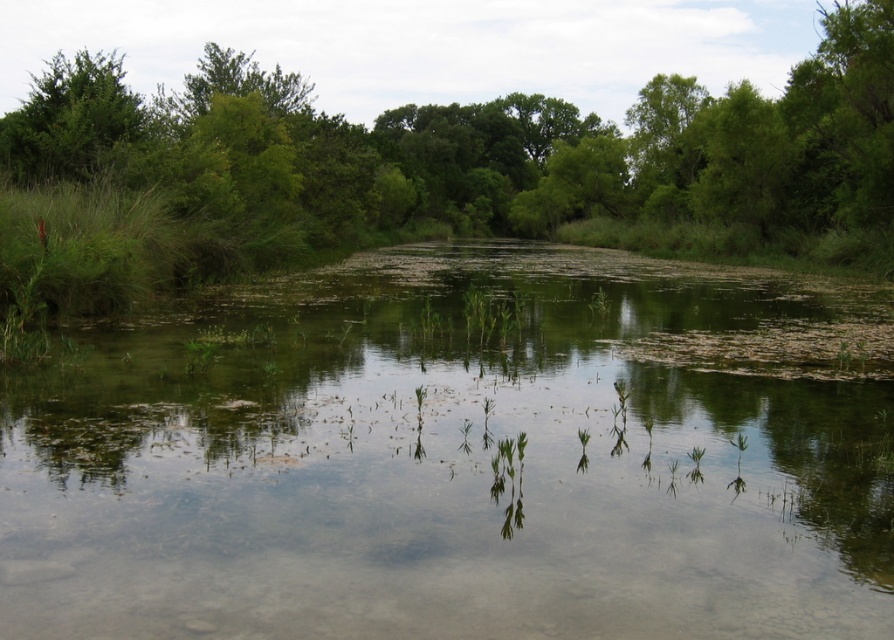
Question: Is clear water at center to the right of green leafy tree at upper left from the viewer's perspective?

Choices:
 (A) no
 (B) yes

Answer: (B)

Question: Which object is closer to the camera taking this photo?

Choices:
 (A) green leafy tree at upper left
 (B) clear water at center

Answer: (B)

Question: Which object is closer to the camera taking this photo?

Choices:
 (A) green leafy tree at upper left
 (B) clear water at center

Answer: (B)

Question: From the image, what is the correct spatial relationship of clear water at center in relation to green leafy tree at upper left?

Choices:
 (A) above
 (B) below

Answer: (B)

Question: Which object is closer to the camera taking this photo?

Choices:
 (A) clear water at center
 (B) green leafy tree at upper left

Answer: (A)

Question: Considering the relative positions of clear water at center and green leafy tree at upper left in the image provided, where is clear water at center located with respect to green leafy tree at upper left?

Choices:
 (A) left
 (B) right

Answer: (B)